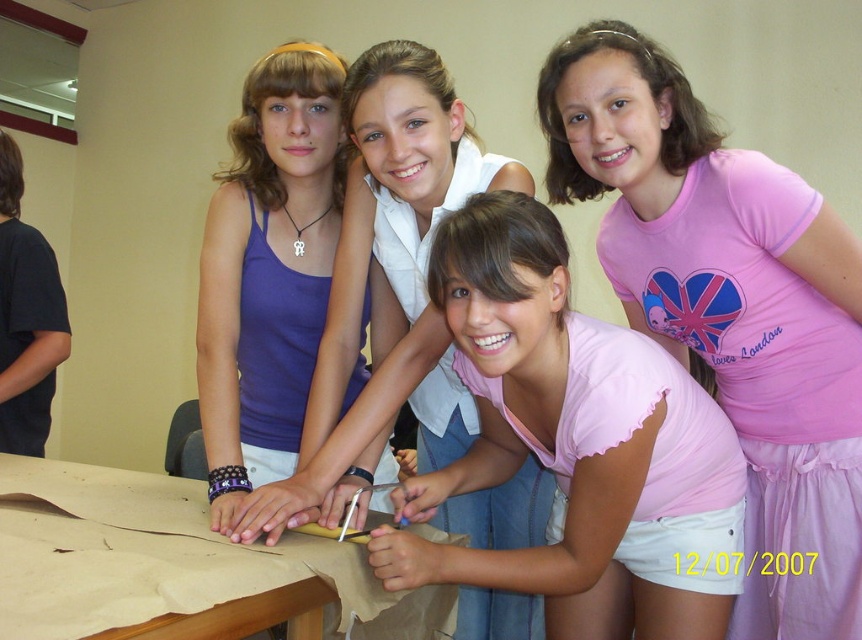
Is matte blue tank top at upper left positioned before brown wooden table at center?

No, it is not.

Who is more distant from viewer, (x=442, y=83) or (x=175, y=509)?

Positioned behind is point (x=175, y=509).

Where is `matte blue tank top at upper left`? This screenshot has width=862, height=640. matte blue tank top at upper left is located at coordinates (394, 268).

Between matte blue tank top at upper left and matte purple tank top at upper left, which one has less height?

Standing shorter between the two is matte purple tank top at upper left.

Where is `matte blue tank top at upper left`? matte blue tank top at upper left is located at coordinates [x=394, y=268].

Does pink fabric shirt at upper right appear over pink cotton shirt at center?

Yes.

Is point (626, 156) closer to viewer compared to point (453, 292)?

No, it is behind (453, 292).

Who is more distant from viewer, (x=688, y=348) or (x=650, y=547)?

The point (x=688, y=348) is more distant.

The image size is (862, 640). In order to click on pink fabric shirt at upper right in this screenshot , I will do `click(728, 307)`.